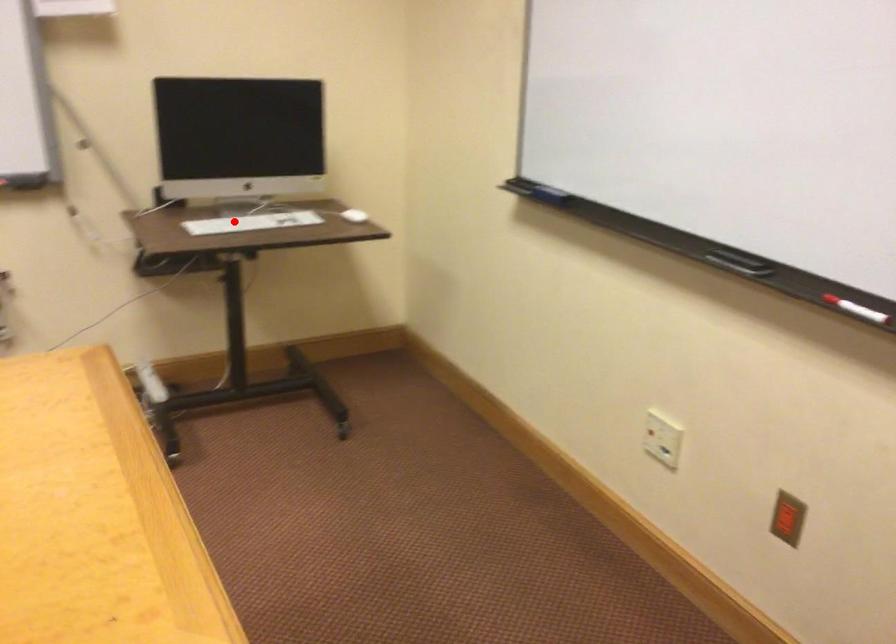
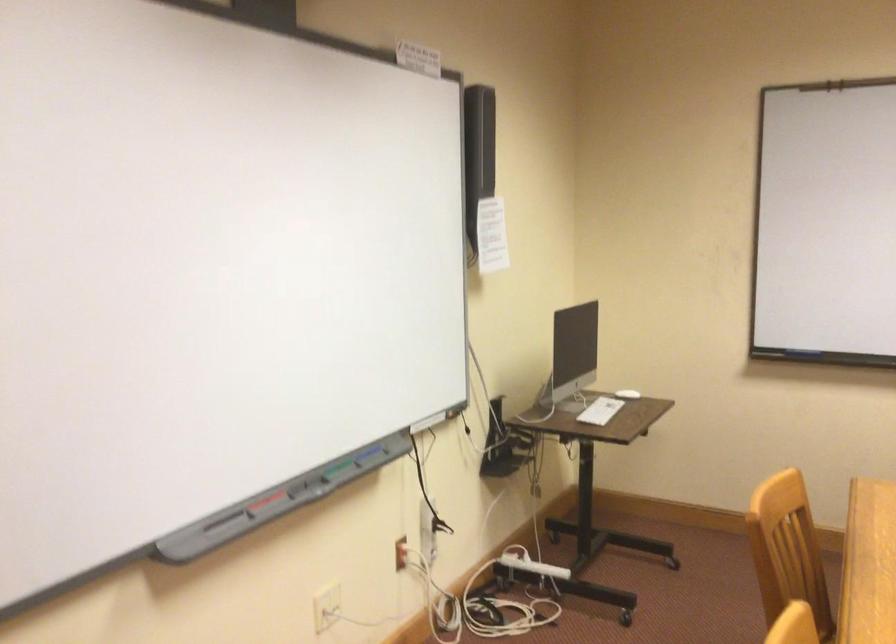
The point at the highlighted location is marked in the first image. Where is the corresponding point in the second image?

(600, 410)